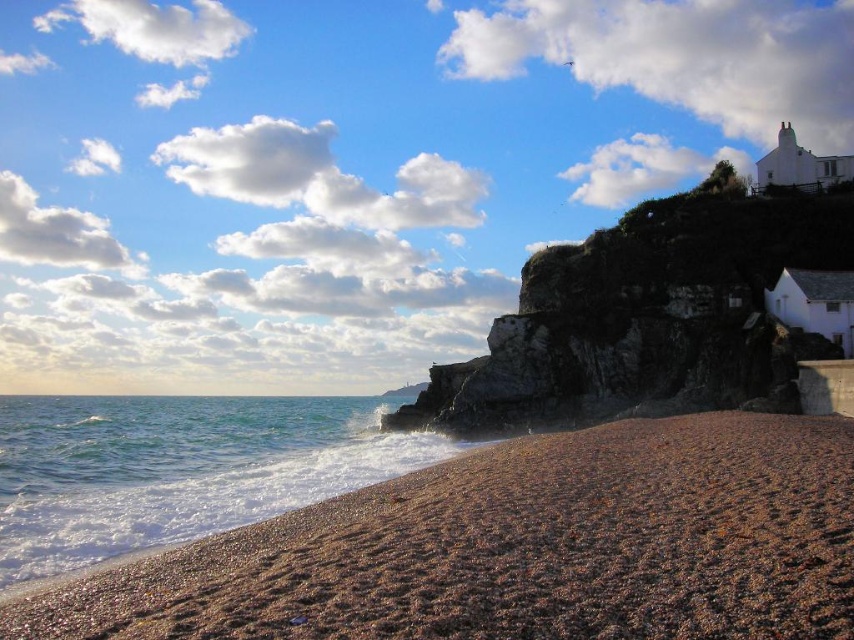
Question: Which object appears closest to the camera in this image?

Choices:
 (A) clear water at lower left
 (B) brown gravelly sand at lower left
 (C) rugged stone cliff at upper right

Answer: (B)

Question: Can you confirm if brown gravelly sand at lower left is positioned below rugged stone cliff at upper right?

Choices:
 (A) yes
 (B) no

Answer: (A)

Question: Which point appears farthest from the camera in this image?

Choices:
 (A) (273, 412)
 (B) (810, 211)
 (C) (297, 536)

Answer: (A)

Question: Can you confirm if rugged stone cliff at upper right is positioned to the right of clear water at lower left?

Choices:
 (A) yes
 (B) no

Answer: (A)

Question: Is brown gravelly sand at lower left bigger than clear water at lower left?

Choices:
 (A) yes
 (B) no

Answer: (B)

Question: Which object is positioned farthest from the brown gravelly sand at lower left?

Choices:
 (A) rugged stone cliff at upper right
 (B) clear water at lower left

Answer: (B)